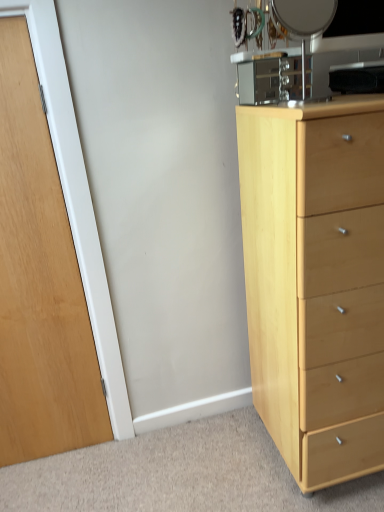
Question: Is light wood chest of drawers at right in front of or behind wooden door at left in the image?

Choices:
 (A) front
 (B) behind

Answer: (A)

Question: Considering the positions of light wood chest of drawers at right and wooden door at left in the image, is light wood chest of drawers at right wider or thinner than wooden door at left?

Choices:
 (A) thin
 (B) wide

Answer: (B)

Question: Which object is the closest to the wooden door at left?

Choices:
 (A) light wood chest of drawers at right
 (B) metallic silver mirror at upper right

Answer: (A)

Question: Which is farther from the metallic silver mirror at upper right?

Choices:
 (A) wooden door at left
 (B) light wood chest of drawers at right

Answer: (A)